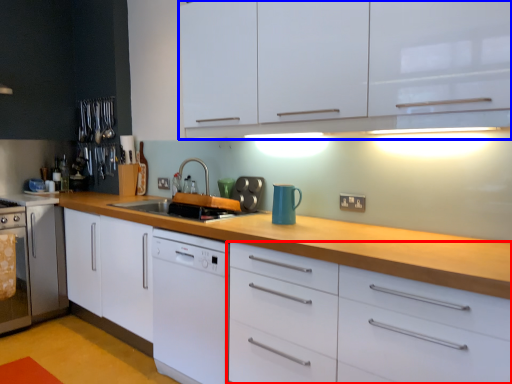
Question: Which object appears closest to the camera in this image, drawer (highlighted by a red box) or cabinetry (highlighted by a blue box)?

Choices:
 (A) drawer
 (B) cabinetry

Answer: (A)